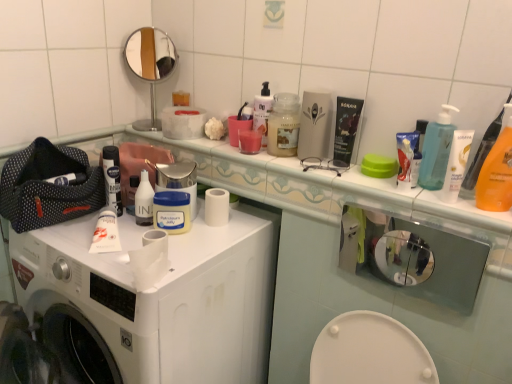
This screenshot has height=384, width=512. I want to click on free space between metallic silver glasses at upper center and white glossy lotion at upper right, acting as the second toiletry starting from the back, so click(x=380, y=193).